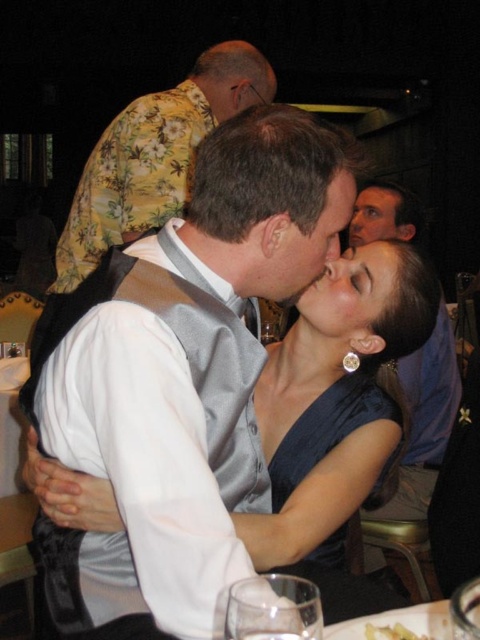
You are a photographer at the event and want to capture a closeup of the smooth skin face at center without the clear glass at lower center appearing in the shot. How should you adjust your camera angle?

The clear glass at lower center is positioned on the left side of the smooth skin face at center. To avoid capturing the clear glass at lower center, the photographer should move the camera to the right side of the smooth skin face at center so that the clear glass at lower center is out of frame.

You are a photographer at the event and want to capture a photo of the couple without any distractions. The yellow floral shirt at upper left and the clear glass at lower center might block the view. Which object is taller and would likely obstruct the camera lens more?

The yellow floral shirt at upper left is much taller than the clear glass at lower center, so it would likely obstruct the camera lens more.